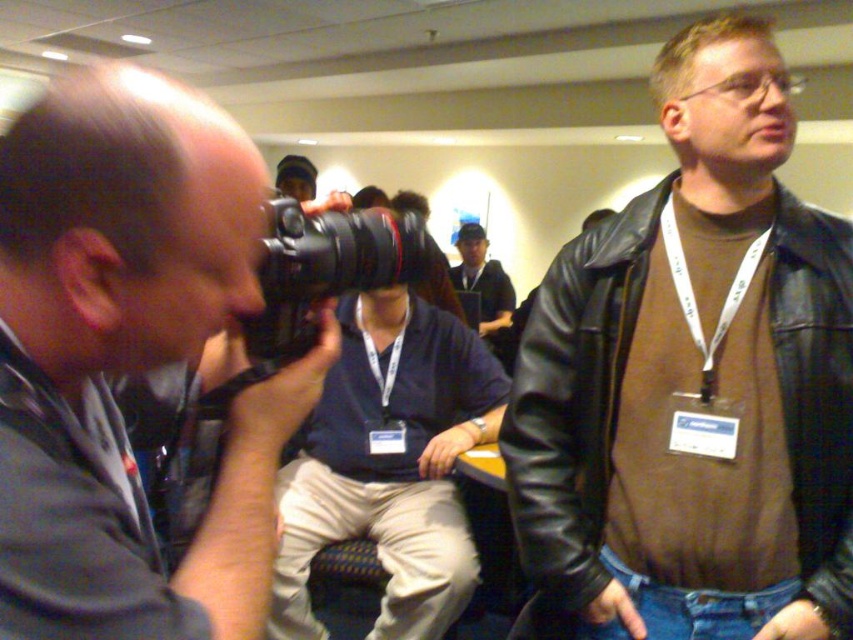
Between blue fabric shirt at center and black plastic camera at center, which one has more height?

blue fabric shirt at center is taller.

Is point (445, 525) closer to viewer compared to point (325, 246)?

No, (445, 525) is further to viewer.

Identify the location of blue fabric shirt at center. This screenshot has height=640, width=853. (389, 465).

Is point (57, 404) in front of point (489, 289)?

Yes, point (57, 404) is in front of point (489, 289).

Does matte black camera at left have a lesser width compared to blue fabric cap at center?

Yes, matte black camera at left is thinner than blue fabric cap at center.

Image resolution: width=853 pixels, height=640 pixels. I want to click on matte black camera at left, so click(131, 358).

From the picture: Who is higher up, matte black camera at left or black leather jacket at upper right?

matte black camera at left

Does matte black camera at left appear under black leather jacket at upper right?

Incorrect, matte black camera at left is not positioned below black leather jacket at upper right.

Between point (42, 372) and point (583, 605), which one is positioned behind?

Point (583, 605)

Where is `matte black camera at left`? The height and width of the screenshot is (640, 853). matte black camera at left is located at coordinates (131, 358).